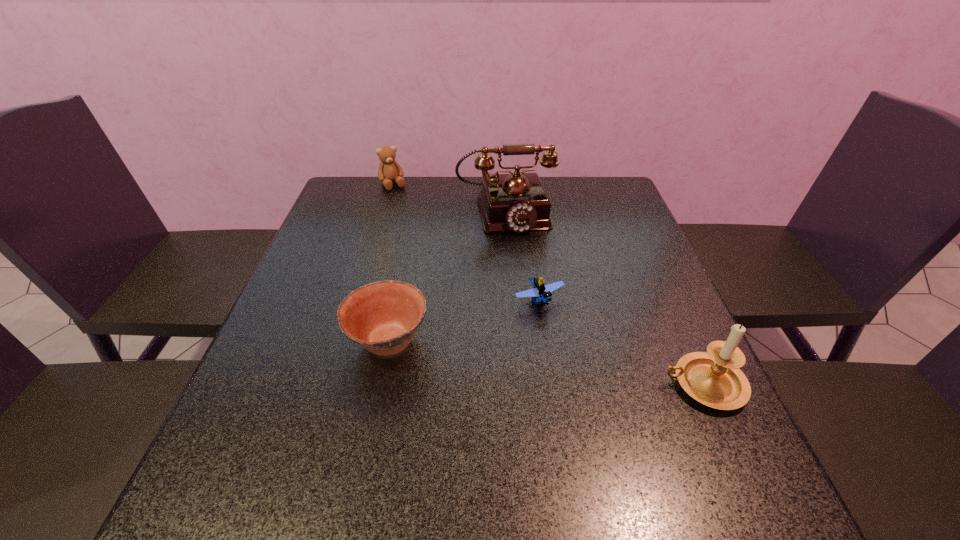
Image resolution: width=960 pixels, height=540 pixels. Find the location of `free space on the desktop that is between the fourth tallest object and the rightmost object and is positioned on the dial of the tallest object`. free space on the desktop that is between the fourth tallest object and the rightmost object and is positioned on the dial of the tallest object is located at coordinates (547, 363).

Where is `vacant space on the desktop that is between the fourth tallest object and the second tallest object and is positioned on the face of the third tallest object`? This screenshot has height=540, width=960. vacant space on the desktop that is between the fourth tallest object and the second tallest object and is positioned on the face of the third tallest object is located at coordinates (505, 357).

The width and height of the screenshot is (960, 540). Find the location of `free spot on the desktop that is between the second shortest object and the fourth shortest object and is positioned on the front-facing side of the shortest object`. free spot on the desktop that is between the second shortest object and the fourth shortest object and is positioned on the front-facing side of the shortest object is located at coordinates (586, 368).